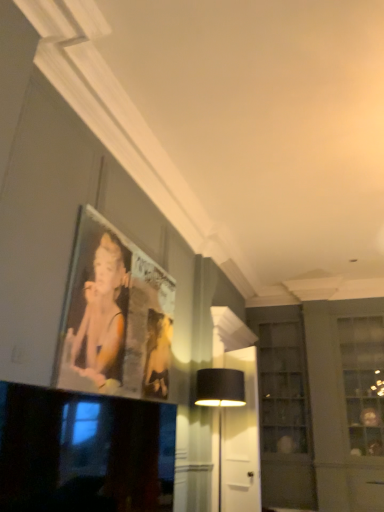
Question: From the image's perspective, is clear glass cabinet at center right beneath black glossy television at lower left?

Choices:
 (A) yes
 (B) no

Answer: (A)

Question: Is clear glass cabinet at center right turned away from black glossy television at lower left?

Choices:
 (A) yes
 (B) no

Answer: (B)

Question: Considering the relative sizes of clear glass cabinet at center right and black glossy television at lower left in the image provided, is clear glass cabinet at center right smaller than black glossy television at lower left?

Choices:
 (A) yes
 (B) no

Answer: (B)

Question: Considering the relative sizes of clear glass cabinet at center right and black glossy television at lower left in the image provided, is clear glass cabinet at center right thinner than black glossy television at lower left?

Choices:
 (A) no
 (B) yes

Answer: (A)

Question: From the image's perspective, is clear glass cabinet at center right on black glossy television at lower left?

Choices:
 (A) yes
 (B) no

Answer: (B)

Question: Is black glossy television at lower left inside or outside of metallic silver picture frame at upper left?

Choices:
 (A) inside
 (B) outside

Answer: (B)

Question: From a real-world perspective, is black glossy television at lower left physically located above or below metallic silver picture frame at upper left?

Choices:
 (A) below
 (B) above

Answer: (A)

Question: Is black glossy television at lower left to the left or to the right of metallic silver picture frame at upper left in the image?

Choices:
 (A) right
 (B) left

Answer: (A)

Question: In terms of width, does black glossy television at lower left look wider or thinner when compared to metallic silver picture frame at upper left?

Choices:
 (A) thin
 (B) wide

Answer: (B)

Question: From a real-world perspective, is black fabric table lamp at center positioned above or below black glossy television at lower left?

Choices:
 (A) below
 (B) above

Answer: (B)

Question: Is black fabric table lamp at center to the left or to the right of black glossy television at lower left in the image?

Choices:
 (A) left
 (B) right

Answer: (B)

Question: Is black fabric table lamp at center in front of or behind black glossy television at lower left in the image?

Choices:
 (A) behind
 (B) front

Answer: (A)

Question: Considering the positions of black fabric table lamp at center and black glossy television at lower left in the image, is black fabric table lamp at center bigger or smaller than black glossy television at lower left?

Choices:
 (A) small
 (B) big

Answer: (B)

Question: Based on their sizes in the image, would you say metallic silver picture frame at upper left is bigger or smaller than black glossy television at lower left?

Choices:
 (A) small
 (B) big

Answer: (B)

Question: Do you think metallic silver picture frame at upper left is within black glossy television at lower left, or outside of it?

Choices:
 (A) inside
 (B) outside

Answer: (B)